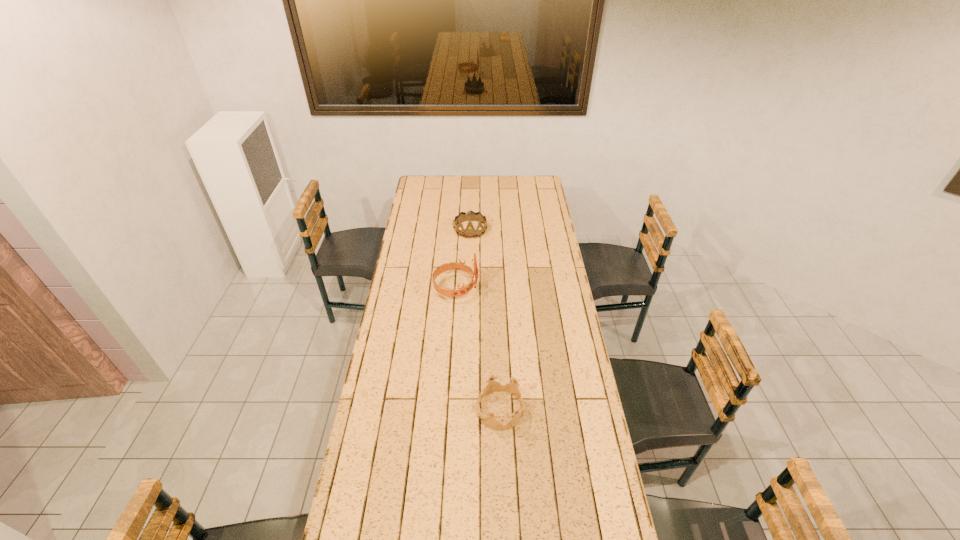
In order to click on free region located 0.290m on the front-facing side of the shortest tiara in this screenshot , I will do `click(396, 410)`.

This screenshot has height=540, width=960. In the image, there is a desktop. Find the location of `vacant space at the far edge`. vacant space at the far edge is located at coordinates (505, 176).

You are a GUI agent. You are given a task and a screenshot of the screen. Output one action in this format:
    pyautogui.click(x=<x>, y=<y>)
    Task: Click on the blank area at the left edge
    This screenshot has width=960, height=540.
    Given the screenshot: What is the action you would take?
    pyautogui.click(x=383, y=426)

In the image, there is a desktop. Identify the location of vacant space at the right edge. (561, 285).

I want to click on free space at the far left corner of the desktop, so click(x=425, y=190).

In the image, there is a desktop. Identify the location of vacant space at the far right corner. This screenshot has height=540, width=960. (x=541, y=191).

Find the location of a particular element. This screenshot has width=960, height=540. vacant region between the second farthest object and the second shortest tiara is located at coordinates (464, 259).

At what (x,y) coordinates should I click in order to perform the action: click on blank region between the shortest tiara and the farthest object. Please return your answer as a coordinate pair (x, y). Looking at the image, I should click on (486, 320).

The height and width of the screenshot is (540, 960). Find the location of `vacant area between the nearest tiara and the farthest object`. vacant area between the nearest tiara and the farthest object is located at coordinates (486, 320).

Locate an element on the screen. This screenshot has height=540, width=960. empty location between the nearest object and the farthest object is located at coordinates (486, 320).